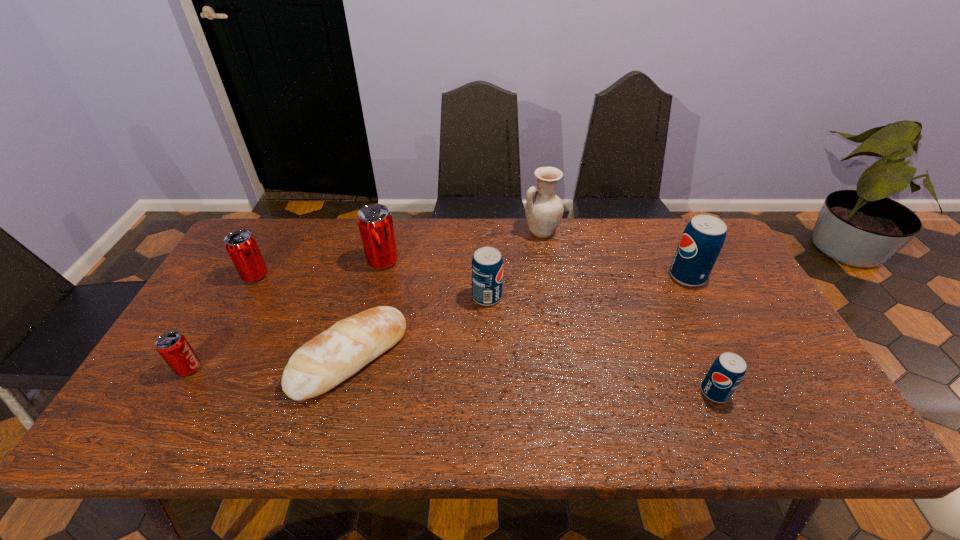
Locate an element on the screen. This screenshot has height=540, width=960. the sixth object from left to right is located at coordinates (544, 210).

At what (x,y) coordinates should I click in order to perform the action: click on the farthest object. Please return your answer as a coordinate pair (x, y). The image size is (960, 540). Looking at the image, I should click on (544, 210).

I want to click on the biggest red soda can, so click(x=375, y=223).

Locate an element on the screen. the rightmost red soda can is located at coordinates (375, 223).

Where is `the biggest blue pop`? Image resolution: width=960 pixels, height=540 pixels. the biggest blue pop is located at coordinates (703, 238).

Where is `the second smallest red soda can`? The height and width of the screenshot is (540, 960). the second smallest red soda can is located at coordinates (241, 245).

You are a GUI agent. You are given a task and a screenshot of the screen. Output one action in this format:
    pyautogui.click(x=<x>, y=<y>)
    Task: Click on the second smallest blue pop
    The image size is (960, 540).
    Given the screenshot: What is the action you would take?
    pos(487,263)

Identify the location of the leftmost blue pop. (487, 263).

This screenshot has height=540, width=960. I want to click on the nearest red soda can, so click(173, 347).

At what (x,y) coordinates should I click in order to perform the action: click on the smallest red soda can. Please return your answer as a coordinate pair (x, y). Image resolution: width=960 pixels, height=540 pixels. Looking at the image, I should click on (173, 347).